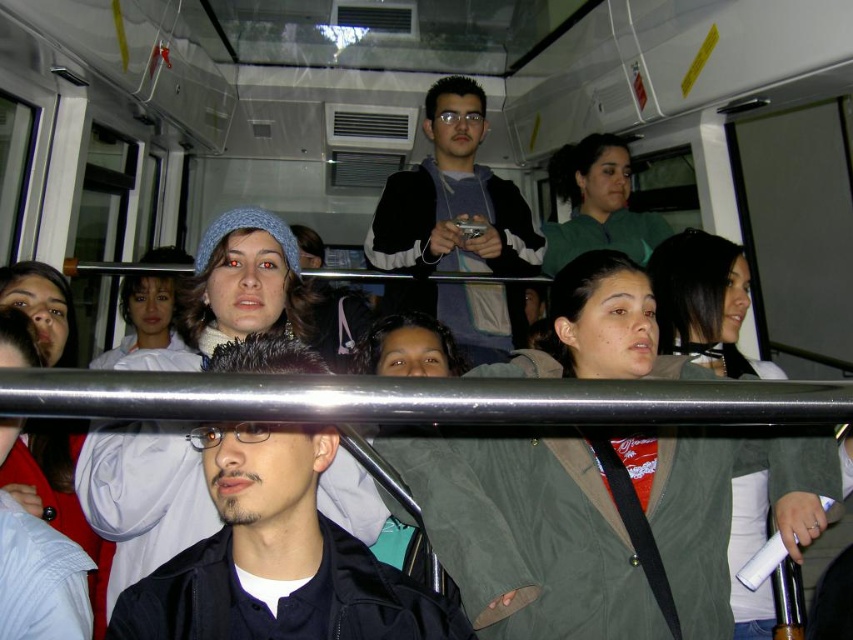
Question: Among these points, which one is nearest to the camera?

Choices:
 (A) (583, 141)
 (B) (323, 531)

Answer: (B)

Question: Which point is closer to the camera?

Choices:
 (A) (630, 177)
 (B) (418, 627)

Answer: (B)

Question: Does black sweater at center lie behind green matte jacket at upper center?

Choices:
 (A) no
 (B) yes

Answer: (A)

Question: Is dark blue jacket at center closer to camera compared to green matte jacket at upper center?

Choices:
 (A) no
 (B) yes

Answer: (B)

Question: Based on their relative distances, which object is farther from the black sweater at center?

Choices:
 (A) green matte jacket at upper center
 (B) dark blue jacket at center

Answer: (B)

Question: Considering the relative positions of black sweater at center and green matte jacket at upper center in the image provided, where is black sweater at center located with respect to green matte jacket at upper center?

Choices:
 (A) above
 (B) below

Answer: (B)